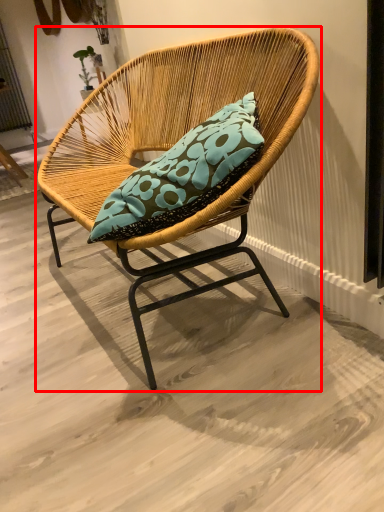
Question: Observing the image, what is the correct spatial positioning of chair (annotated by the red box) in reference to screen door?

Choices:
 (A) left
 (B) right

Answer: (B)